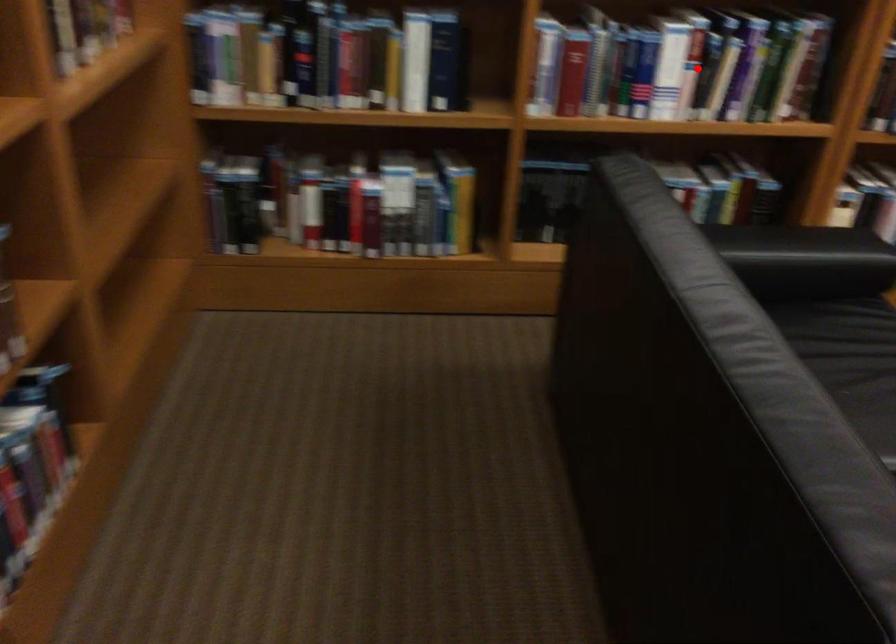
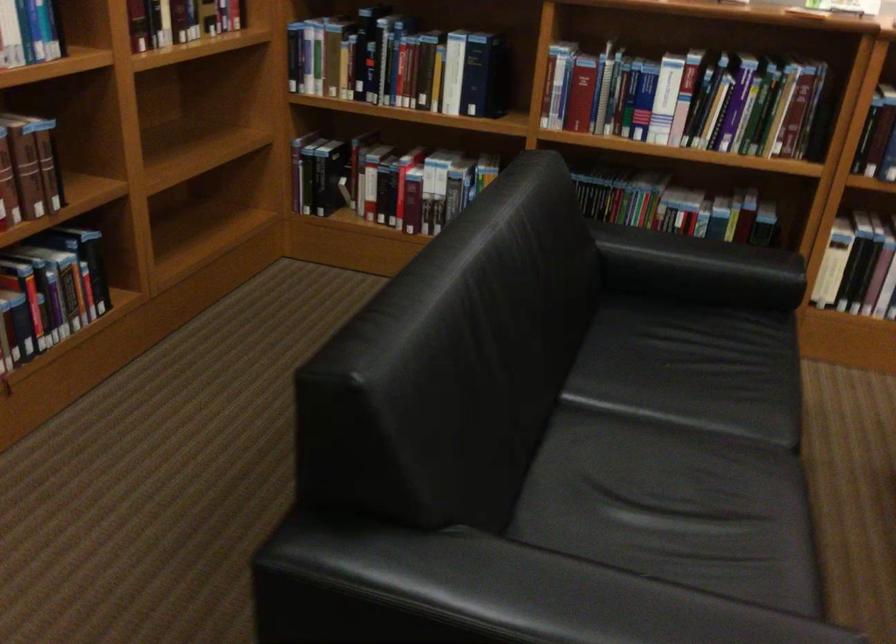
The point at the highlighted location is marked in the first image. Where is the corresponding point in the second image?

(688, 100)